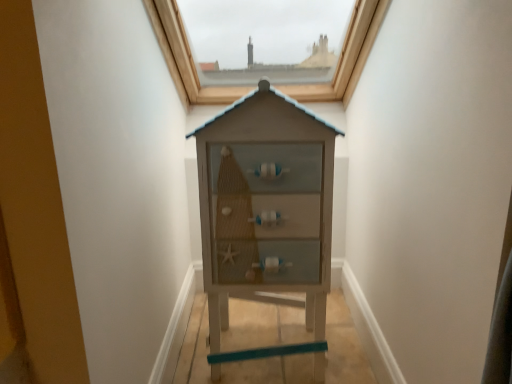
Question: From the image's perspective, is wooden cabinet at center above or below matte brown wooden window at upper center?

Choices:
 (A) below
 (B) above

Answer: (A)

Question: Looking at their shapes, would you say wooden cabinet at center is wider or thinner than matte brown wooden window at upper center?

Choices:
 (A) wide
 (B) thin

Answer: (B)

Question: In terms of size, does wooden cabinet at center appear bigger or smaller than matte brown wooden window at upper center?

Choices:
 (A) big
 (B) small

Answer: (B)

Question: In terms of height, does matte brown wooden window at upper center look taller or shorter compared to wooden cabinet at center?

Choices:
 (A) short
 (B) tall

Answer: (A)

Question: Is matte brown wooden window at upper center in front of or behind wooden cabinet at center in the image?

Choices:
 (A) behind
 (B) front

Answer: (A)

Question: Is matte brown wooden window at upper center to the left or to the right of wooden cabinet at center in the image?

Choices:
 (A) left
 (B) right

Answer: (A)

Question: From a real-world perspective, is matte brown wooden window at upper center positioned above or below wooden cabinet at center?

Choices:
 (A) above
 (B) below

Answer: (A)